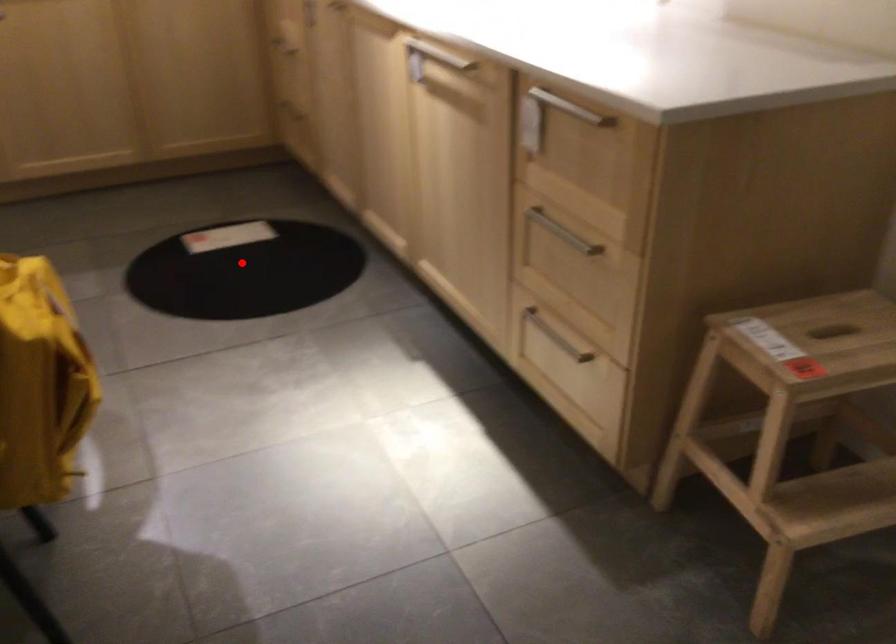
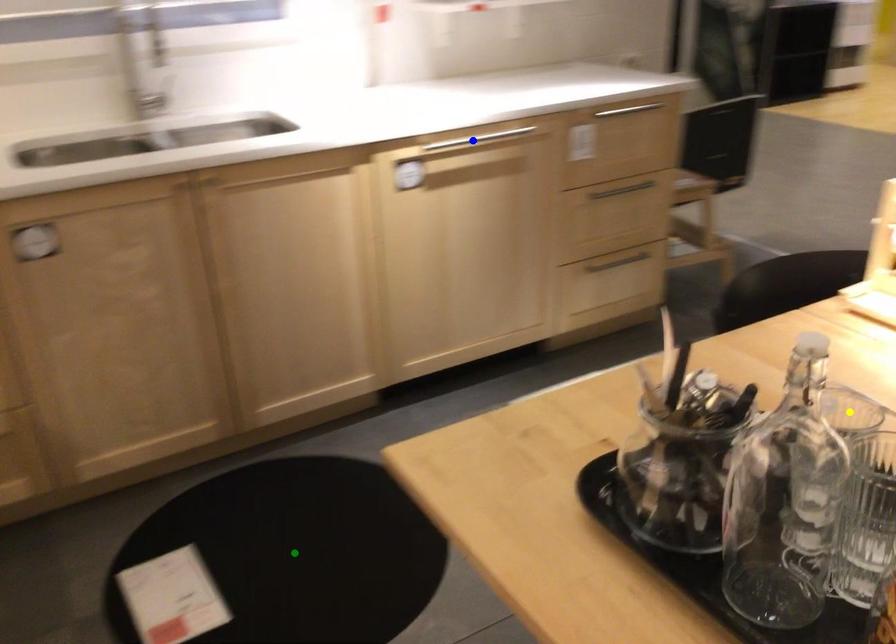
Question: I am providing you with two images of the same scene from different viewpoints. A red point is marked on the first image. You are given multiple points on the second image. Which point in image 2 is actually the same real-world point as the red point in image 1?

Choices:
 (A) green point
 (B) blue point
 (C) yellow point

Answer: (A)